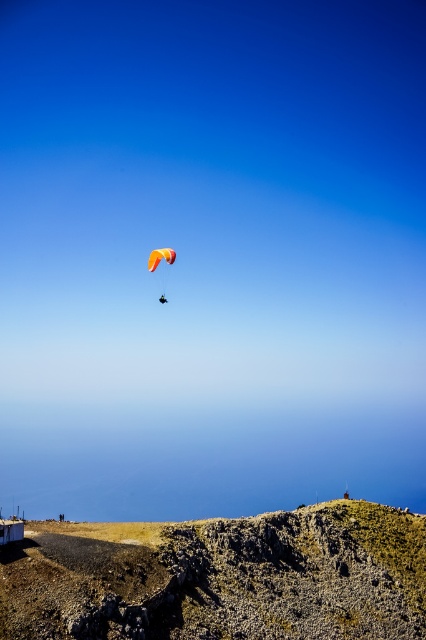
You are standing on the rugged stone hillside at lower center and want to reach the orange fabric parachute at center. Which direction should you move to get closer to the parachute?

Since the rugged stone hillside at lower center is in front of the orange fabric parachute at center, you should move backward to get closer to the parachute.

You are standing on the rugged stone hillside at lower center and want to look towards the orange fabric parachute at center. Which direction should you turn your head?

The rugged stone hillside at lower center is positioned on the right side of orange fabric parachute at center, so you should turn your head to the left to face the orange fabric parachute at center.